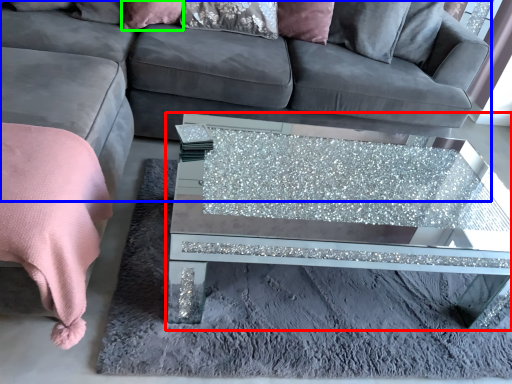
Question: Which is farther away from coffee table (highlighted by a red box)? studio couch (highlighted by a blue box) or pillow (highlighted by a green box)?

Choices:
 (A) studio couch
 (B) pillow

Answer: (B)